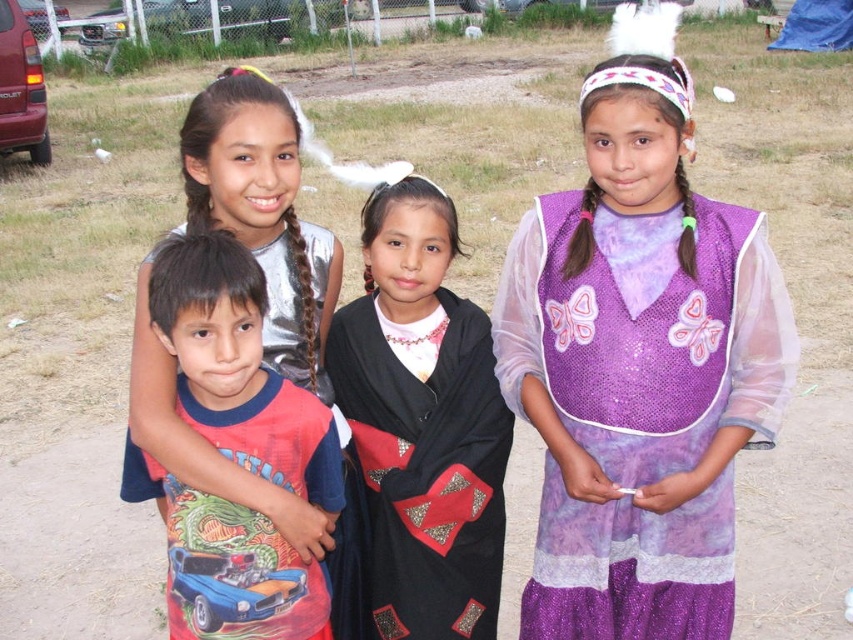
Question: Can you confirm if red t-shirt at center is smaller than silver metallic dress at upper left?

Choices:
 (A) no
 (B) yes

Answer: (B)

Question: Which of the following is the closest to the observer?

Choices:
 (A) black sequined shawl at center
 (B) purple sequined dress at center
 (C) red t-shirt at center

Answer: (C)

Question: Which point is closer to the camera taking this photo?

Choices:
 (A) (218, 260)
 (B) (170, 435)

Answer: (A)

Question: Does black sequined shawl at center have a greater width compared to silver metallic dress at upper left?

Choices:
 (A) yes
 (B) no

Answer: (A)

Question: Based on their relative distances, which object is nearer to the silver metallic dress at upper left?

Choices:
 (A) red t-shirt at center
 (B) purple sequined dress at center
 (C) black sequined shawl at center

Answer: (A)

Question: Does purple sequined dress at center appear over red t-shirt at center?

Choices:
 (A) no
 (B) yes

Answer: (B)